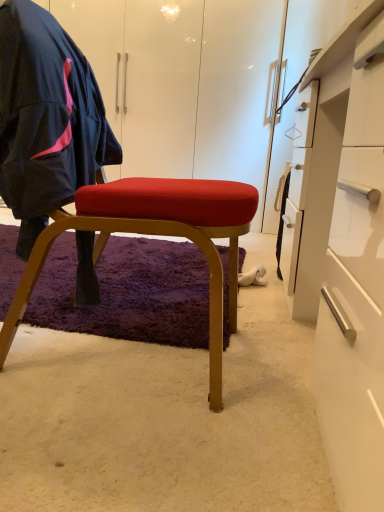
Question: Can you confirm if white suede shoe at lower center is bigger than white glossy desk at center right?

Choices:
 (A) yes
 (B) no

Answer: (B)

Question: Is white suede shoe at lower center at the right side of white glossy desk at center right?

Choices:
 (A) no
 (B) yes

Answer: (A)

Question: Does white suede shoe at lower center have a lesser height compared to white glossy desk at center right?

Choices:
 (A) yes
 (B) no

Answer: (A)

Question: Is white suede shoe at lower center wider than white glossy desk at center right?

Choices:
 (A) no
 (B) yes

Answer: (A)

Question: Considering the relative positions of white suede shoe at lower center and white glossy desk at center right in the image provided, is white suede shoe at lower center in front of white glossy desk at center right?

Choices:
 (A) no
 (B) yes

Answer: (A)

Question: Is white glossy desk at center right wider or thinner than matte black jacket at left?

Choices:
 (A) wide
 (B) thin

Answer: (A)

Question: Considering their positions, is white glossy desk at center right located in front of or behind matte black jacket at left?

Choices:
 (A) front
 (B) behind

Answer: (A)

Question: In terms of size, does white glossy desk at center right appear bigger or smaller than matte black jacket at left?

Choices:
 (A) big
 (B) small

Answer: (A)

Question: Visually, is white glossy desk at center right positioned to the left or to the right of matte black jacket at left?

Choices:
 (A) right
 (B) left

Answer: (A)

Question: Is matte black jacket at left inside the boundaries of matte gold stool at center, or outside?

Choices:
 (A) inside
 (B) outside

Answer: (A)

Question: Considering the positions of matte black jacket at left and matte gold stool at center in the image, is matte black jacket at left bigger or smaller than matte gold stool at center?

Choices:
 (A) small
 (B) big

Answer: (A)

Question: In terms of width, does matte black jacket at left look wider or thinner when compared to matte gold stool at center?

Choices:
 (A) thin
 (B) wide

Answer: (A)

Question: From their relative heights in the image, would you say matte black jacket at left is taller or shorter than matte gold stool at center?

Choices:
 (A) short
 (B) tall

Answer: (A)

Question: Is white suede shoe at lower center inside or outside of white glossy desk at center right?

Choices:
 (A) outside
 (B) inside

Answer: (A)

Question: From a real-world perspective, is white suede shoe at lower center physically located above or below white glossy desk at center right?

Choices:
 (A) below
 (B) above

Answer: (A)